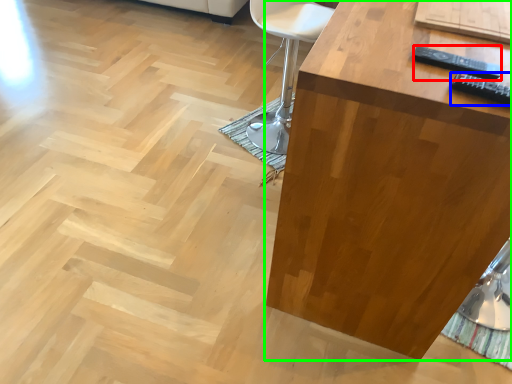
Question: Which object is the farthest from remote (highlighted by a red box)? Choose among these: remote (highlighted by a blue box) or table (highlighted by a green box).

Choices:
 (A) remote
 (B) table

Answer: (B)